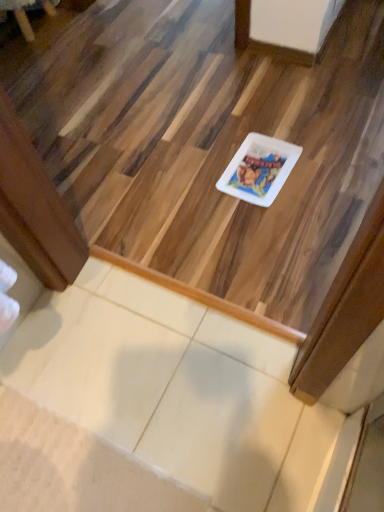
Locate an element on the screen. vacant space to the right of brushed metal table at upper left is located at coordinates (88, 30).